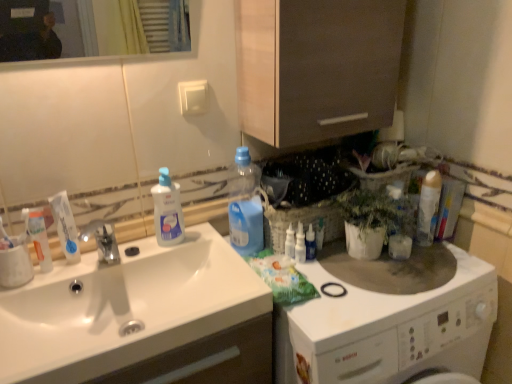
This screenshot has width=512, height=384. I want to click on free spot in front of white matte aerosol can at upper right, marked as the first cleaning product in a right-to-left arrangement, so click(437, 271).